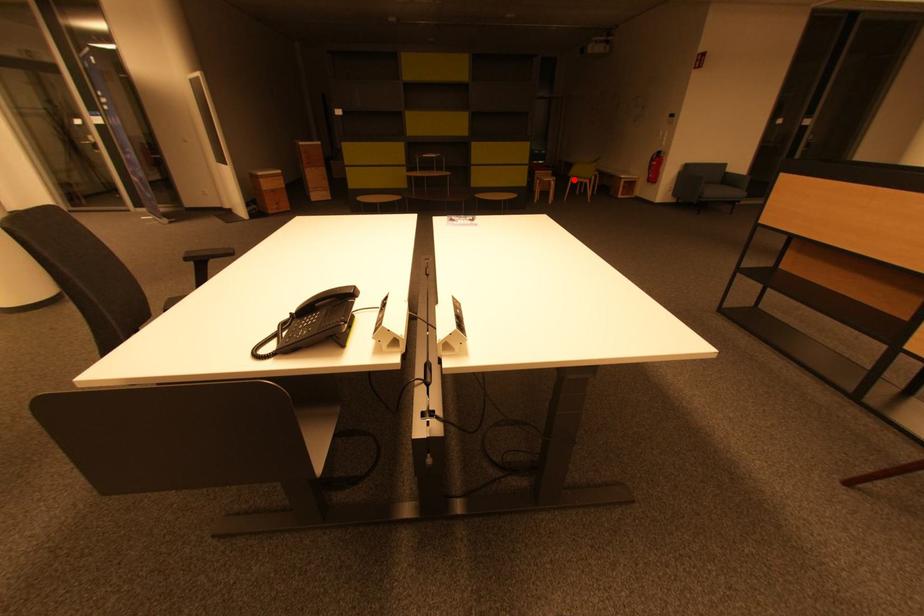
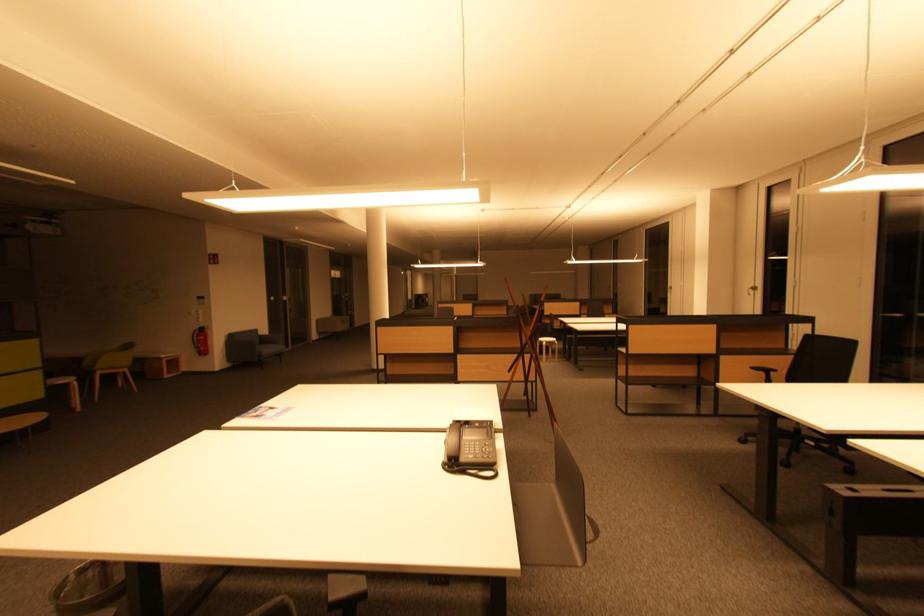
Question: I am providing you with two images of the same scene from different viewpoints. A red point is shown in image1. For the corresponding object point in image2, is it positioned nearer or farther from the camera?

Choices:
 (A) Nearer
 (B) Farther

Answer: (B)